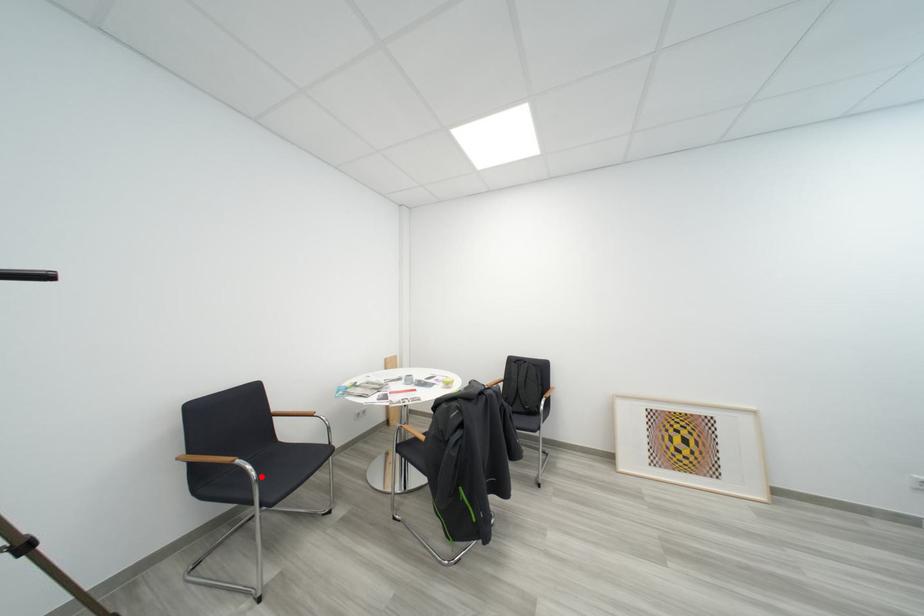
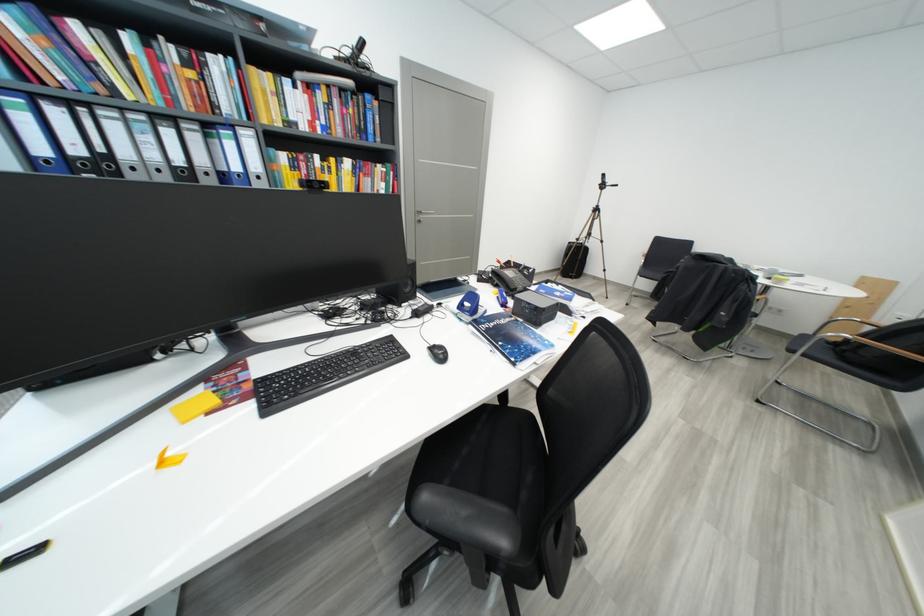
Where in the second image is the point corresponding to the highlighted location from the first image?

(652, 265)